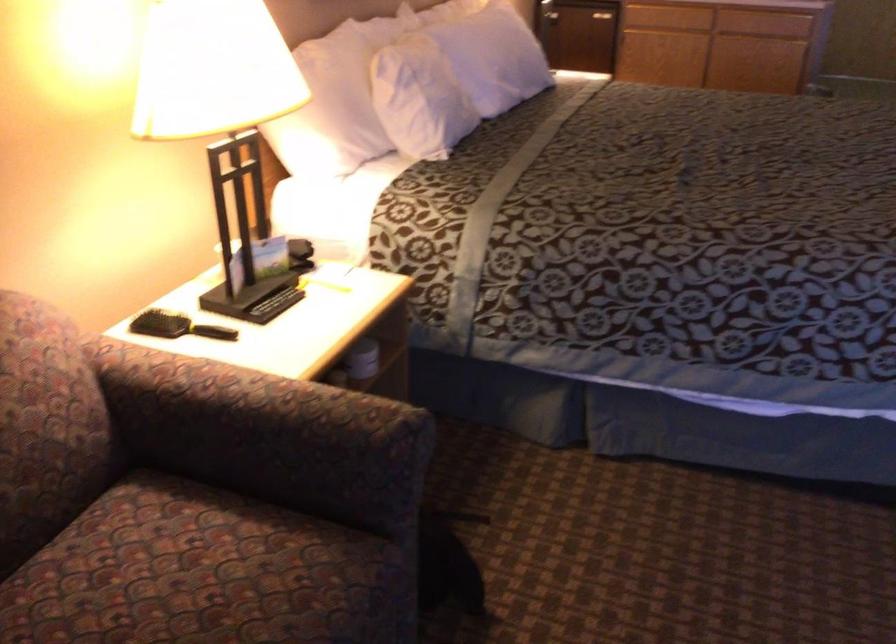
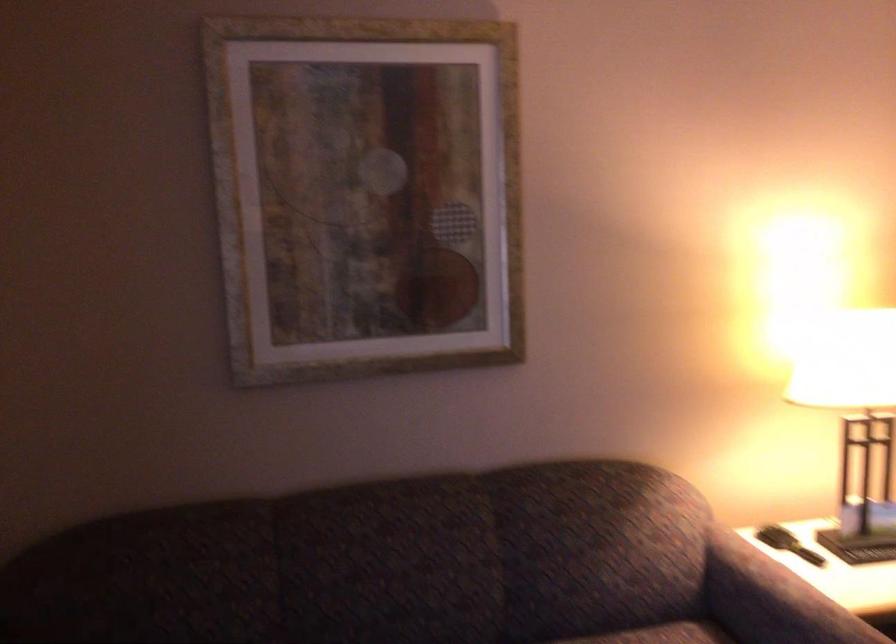
Question: The first image is from the beginning of the video and the second image is from the end. How did the camera likely rotate when shooting the video?

Choices:
 (A) Left
 (B) Right
 (C) Up
 (D) Down

Answer: (A)